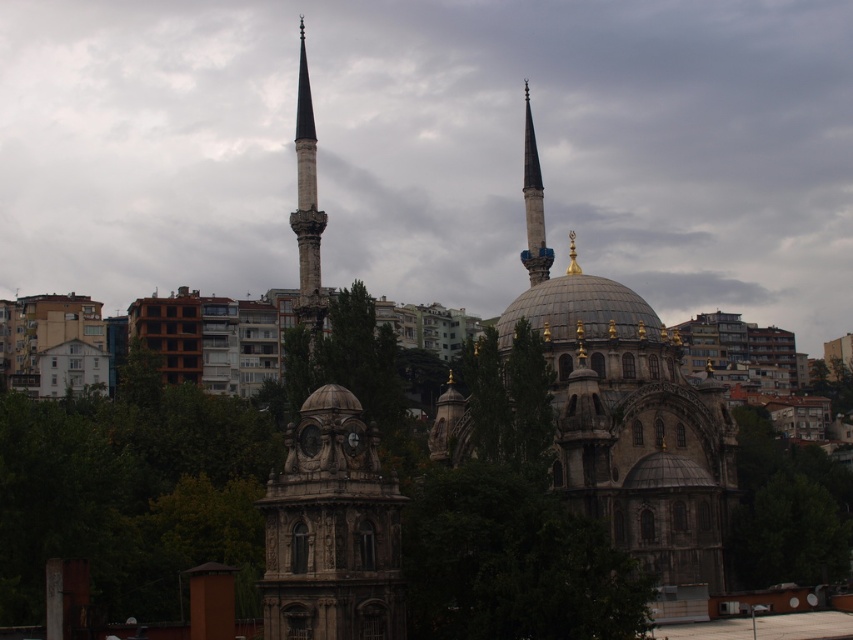
Question: Is green leafy tree at lower left behind green leafy tree at center?

Choices:
 (A) yes
 (B) no

Answer: (A)

Question: Which point is farther to the camera?

Choices:
 (A) (683, 449)
 (B) (183, 419)
 (C) (305, 252)

Answer: (C)

Question: Is green leafy tree at lower right bigger than smooth white minaret at center?

Choices:
 (A) no
 (B) yes

Answer: (B)

Question: Which of the following is the farthest from the observer?

Choices:
 (A) green leafy tree at center
 (B) smooth white minaret at center

Answer: (B)

Question: Can you confirm if stone dome at center is positioned to the right of smooth white minaret at center?

Choices:
 (A) yes
 (B) no

Answer: (A)

Question: Among these points, which one is farthest from the camera?

Choices:
 (A) (639, 384)
 (B) (302, 154)
 (C) (486, 387)

Answer: (B)